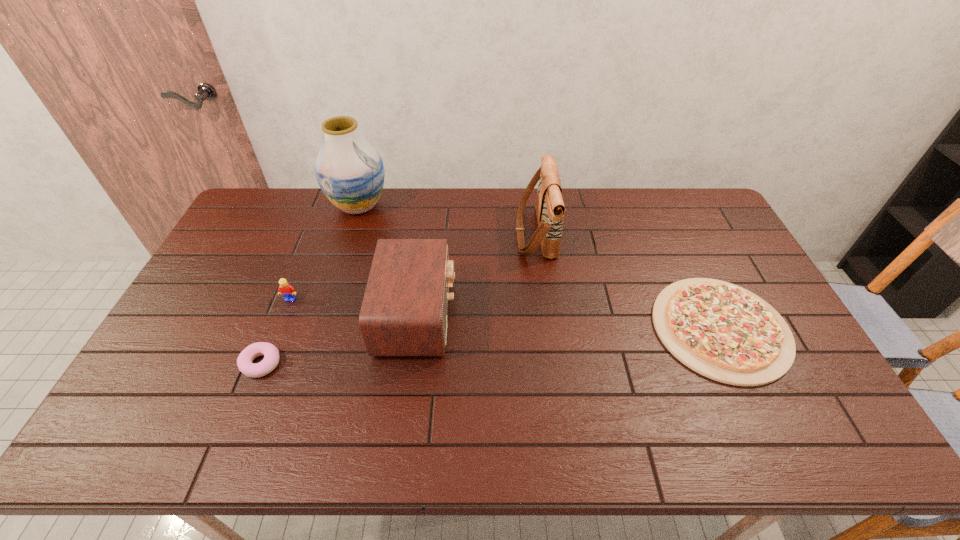
What are the coordinates of `blank space at the far edge` in the screenshot? It's located at (657, 213).

Find the location of `free space at the near edge`. free space at the near edge is located at coordinates (489, 418).

In the image, there is a desktop. Identify the location of vacant space at the left edge. The image size is (960, 540). (194, 341).

What are the coordinates of `vacant space that's between the second shortest object and the rightmost object` in the screenshot? It's located at 491,346.

Identify the location of free spot between the third tallest object and the rightmost object. [x=568, y=322].

Where is `empty space that is in between the pizza and the Lego`? The width and height of the screenshot is (960, 540). empty space that is in between the pizza and the Lego is located at coordinates (506, 314).

This screenshot has width=960, height=540. I want to click on vacant space that is in between the shortest object and the second shortest object, so click(491, 346).

Identify the location of free space that is in between the fourth tallest object and the tallest object. (324, 252).

The image size is (960, 540). Identify the location of free space between the shortest object and the Lego. (506, 314).

Where is `vacant region between the radio receiver and the Lego`? This screenshot has height=540, width=960. vacant region between the radio receiver and the Lego is located at coordinates (353, 307).